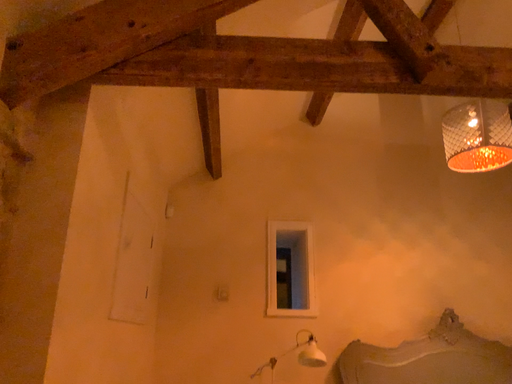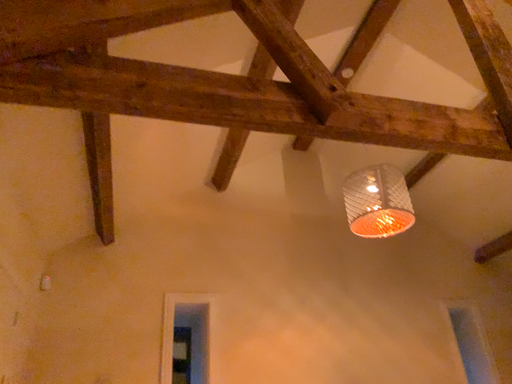
Question: Which way did the camera rotate in the video?

Choices:
 (A) rotated downward
 (B) rotated upward

Answer: (B)